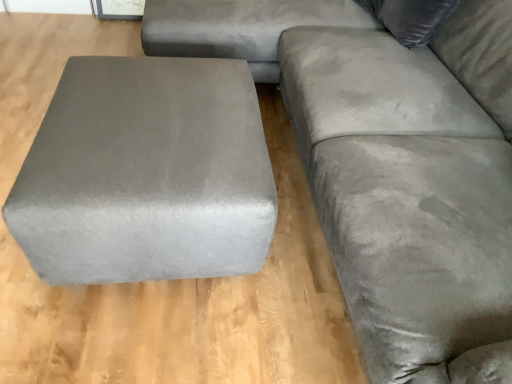
Describe the element at coordinates (390, 165) in the screenshot. I see `suede gray couch at right` at that location.

Locate an element on the screen. The image size is (512, 384). satin gray ottoman at left is located at coordinates (146, 174).

Where is `velvet gray pillow at upper right`? The width and height of the screenshot is (512, 384). velvet gray pillow at upper right is located at coordinates (410, 18).

You are a GUI agent. You are given a task and a screenshot of the screen. Output one action in this format:
    pyautogui.click(x=<x>, y=<y>)
    Task: Click on the suede gray couch at right
    The height and width of the screenshot is (384, 512).
    Given the screenshot: What is the action you would take?
    pyautogui.click(x=390, y=165)

Can you confirm if velvet gray pillow at upper right is bigger than satin gray ottoman at left?

Actually, velvet gray pillow at upper right might be smaller than satin gray ottoman at left.

Is velvet gray pillow at upper right not close to satin gray ottoman at left?

Indeed, velvet gray pillow at upper right is not near satin gray ottoman at left.

From the image's perspective, which object appears higher, velvet gray pillow at upper right or satin gray ottoman at left?

velvet gray pillow at upper right, from the image's perspective.

Is velvet gray pillow at upper right turned away from satin gray ottoman at left?

No, velvet gray pillow at upper right is not facing away from satin gray ottoman at left.

Which of these two, suede gray couch at right or satin gray ottoman at left, is thinner?

satin gray ottoman at left.

From a real-world perspective, who is located higher, suede gray couch at right or satin gray ottoman at left?

suede gray couch at right, from a real-world perspective.

Is suede gray couch at right positioned far away from satin gray ottoman at left?

No.

From the image's perspective, relative to satin gray ottoman at left, is suede gray couch at right above or below?

suede gray couch at right is situated higher than satin gray ottoman at left in the image.

From a real-world perspective, is velvet gray pillow at upper right below suede gray couch at right?

No, from a real-world perspective, velvet gray pillow at upper right is not below suede gray couch at right.

Which is in front, point (412, 19) or point (210, 48)?

The point (412, 19) is in front.

Can you confirm if velvet gray pillow at upper right is positioned to the right of suede gray couch at right?

No, velvet gray pillow at upper right is not to the right of suede gray couch at right.

Is velvet gray pillow at upper right completely or partially inside suede gray couch at right?

Yes, velvet gray pillow at upper right can be found within suede gray couch at right.

From the picture: From the image's perspective, between suede gray couch at right and velvet gray pillow at upper right, who is located below?

suede gray couch at right.

Measure the distance between suede gray couch at right and velvet gray pillow at upper right.

suede gray couch at right is 16.89 inches from velvet gray pillow at upper right.

Is satin gray ottoman at left taller than suede gray couch at right?

No, satin gray ottoman at left is not taller than suede gray couch at right.

Can you tell me how much satin gray ottoman at left and suede gray couch at right differ in facing direction?

They differ by 1.32 degrees in their facing directions.

Is point (192, 156) in front of point (413, 246)?

No, (192, 156) is further to viewer.

From a real-world perspective, is satin gray ottoman at left beneath suede gray couch at right?

Indeed, from a real-world perspective, satin gray ottoman at left is positioned beneath suede gray couch at right.

Are satin gray ottoman at left and velvet gray pillow at upper right far apart?

Yes, satin gray ottoman at left and velvet gray pillow at upper right are located far from each other.

Is velvet gray pillow at upper right at the back of satin gray ottoman at left?

Yes, satin gray ottoman at left's orientation is away from velvet gray pillow at upper right.

Between satin gray ottoman at left and velvet gray pillow at upper right, which one has larger size?

satin gray ottoman at left.

Is satin gray ottoman at left positioned beyond the bounds of velvet gray pillow at upper right?

Yes, satin gray ottoman at left is not within velvet gray pillow at upper right.

In the image, there is a velvet gray pillow at upper right. Identify the location of stool below it (from the image's perspective). The image size is (512, 384). (146, 174).

Identify the location of stool below the suede gray couch at right (from a real-world perspective). (146, 174).

Estimate the real-world distances between objects in this image. Which object is further from suede gray couch at right, satin gray ottoman at left or velvet gray pillow at upper right?

satin gray ottoman at left lies further to suede gray couch at right than the other object.

When comparing their distances from velvet gray pillow at upper right, does satin gray ottoman at left or suede gray couch at right seem further?

satin gray ottoman at left is positioned further to the anchor velvet gray pillow at upper right.

Looking at this image, considering their positions, is suede gray couch at right positioned closer to satin gray ottoman at left than velvet gray pillow at upper right?

suede gray couch at right is closer to satin gray ottoman at left.

Estimate the real-world distances between objects in this image. Which object is closer to satin gray ottoman at left, velvet gray pillow at upper right or suede gray couch at right?

suede gray couch at right is closer to satin gray ottoman at left.

Based on the photo, which object lies nearer to the anchor point velvet gray pillow at upper right, suede gray couch at right or satin gray ottoman at left?

suede gray couch at right is closer to velvet gray pillow at upper right.

Based on their spatial positions, is velvet gray pillow at upper right or satin gray ottoman at left closer to suede gray couch at right?

velvet gray pillow at upper right lies closer to suede gray couch at right than the other object.

I want to click on stool located between suede gray couch at right and velvet gray pillow at upper right in the depth direction, so click(146, 174).